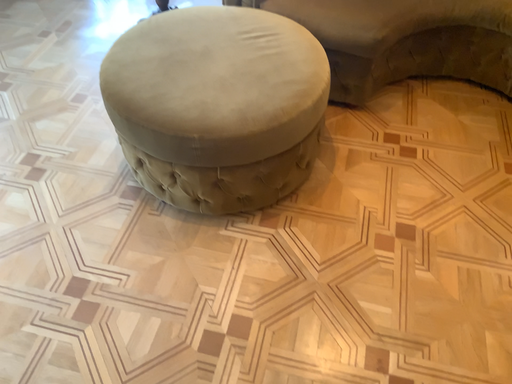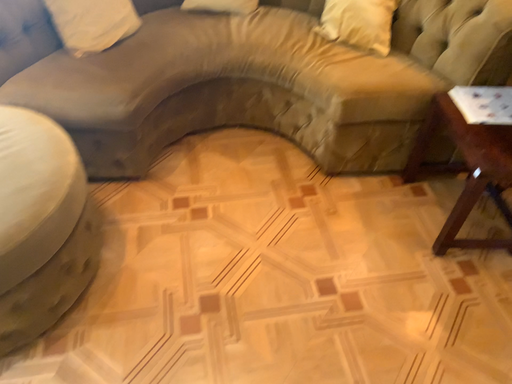
Question: Which way did the camera rotate in the video?

Choices:
 (A) rotated downward
 (B) rotated upward

Answer: (B)